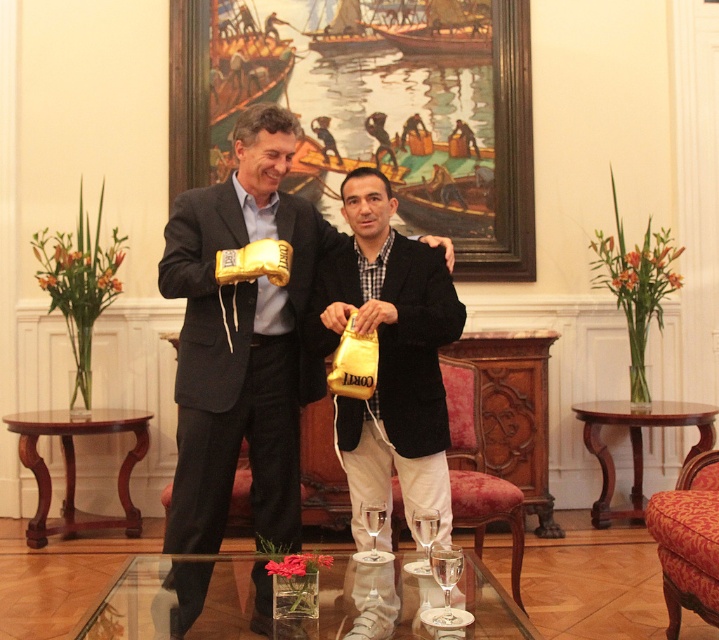
Which is behind, point (336, 300) or point (462, 499)?

The point (462, 499) is behind.

Can you confirm if gold metallic boxing glove at center is taller than velvet upholstered armchair at center?

Yes, gold metallic boxing glove at center is taller than velvet upholstered armchair at center.

The image size is (719, 640). Find the location of `gold metallic boxing glove at center`. gold metallic boxing glove at center is located at coordinates (390, 356).

Identify the location of gold metallic boxing glove at center. This screenshot has height=640, width=719. (390, 356).

Which is above, velvet upholstered armchair at center or red fabric armchair at lower right?

velvet upholstered armchair at center is higher up.

Where is `velvet upholstered armchair at center`? This screenshot has height=640, width=719. velvet upholstered armchair at center is located at coordinates (477, 468).

I want to click on velvet upholstered armchair at center, so click(x=477, y=468).

Is gold metallic boxing gloves at center bigger than velvet upholstered armchair at center?

Indeed, gold metallic boxing gloves at center has a larger size compared to velvet upholstered armchair at center.

Is gold metallic boxing gloves at center closer to the viewer compared to velvet upholstered armchair at center?

Yes, gold metallic boxing gloves at center is in front of velvet upholstered armchair at center.

Does point (273, 333) come closer to viewer compared to point (467, 508)?

Yes, it is in front of point (467, 508).

Find the location of a particular element. gold metallic boxing gloves at center is located at coordinates (242, 340).